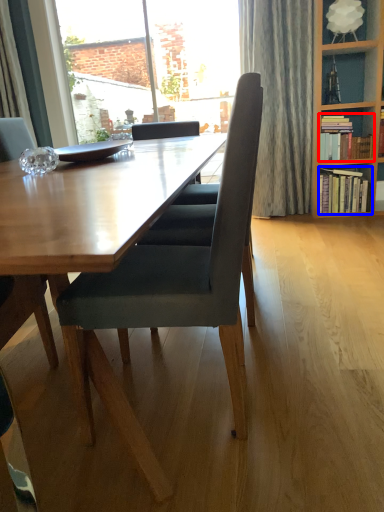
Question: Which point is closer to the camera, book (highlighted by a red box) or book (highlighted by a blue box)?

Choices:
 (A) book
 (B) book

Answer: (A)